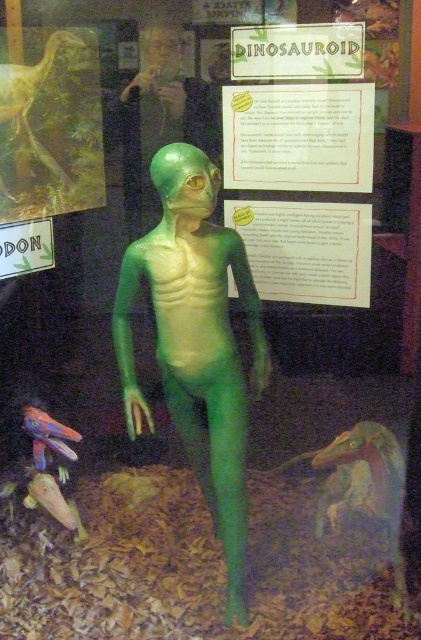
Which is in front, point (368, 109) or point (319, 58)?

Point (319, 58)

Is the position of matte paper sign at center more distant than that of matte plastic sign at upper center?

Yes, it is.

Is point (352, 170) farther from camera compared to point (247, 70)?

No.

Identify the location of matte paper sign at center. (298, 136).

Looking at this image, can you confirm if matte paper sign at center is shorter than matte white sign at upper left?

No, matte paper sign at center is not shorter than matte white sign at upper left.

This screenshot has width=421, height=640. What do you see at coordinates (298, 136) in the screenshot?
I see `matte paper sign at center` at bounding box center [298, 136].

At what (x,y) coordinates should I click in order to perform the action: click on matte paper sign at center. Please return your answer as a coordinate pair (x, y). Looking at the image, I should click on (298, 136).

This screenshot has width=421, height=640. In order to click on matte paper sign at center in this screenshot , I will do `click(298, 136)`.

Who is positioned more to the left, green matte alien at center or matte plastic sign at upper center?

From the viewer's perspective, green matte alien at center appears more on the left side.

Is green matte alien at center wider than matte plastic sign at upper center?

Correct, the width of green matte alien at center exceeds that of matte plastic sign at upper center.

Between point (212, 292) and point (255, 38), which one is positioned behind?

The point (255, 38) is more distant.

Find the location of a particular element. The image size is (421, 640). green matte alien at center is located at coordinates (196, 340).